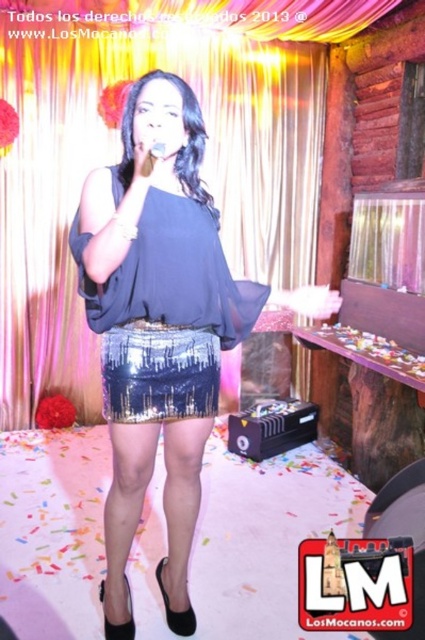
Does metallic gold curtain at upper center have a lesser width compared to shiny sequined skirt at center?

Incorrect, metallic gold curtain at upper center's width is not less than shiny sequined skirt at center's.

Does metallic gold curtain at upper center appear over shiny sequined skirt at center?

Yes.

Between point (34, 237) and point (226, 317), which one is positioned in front?

Positioned in front is point (226, 317).

I want to click on metallic gold curtain at upper center, so click(119, 160).

Consider the image. Between metallic gold curtain at upper center and sparkly sequined skirt at center, which one is positioned higher?

metallic gold curtain at upper center is above.

Is point (246, 141) less distant than point (104, 385)?

No, (246, 141) is further to viewer.

Locate an element on the screen. The height and width of the screenshot is (640, 425). metallic gold curtain at upper center is located at coordinates (119, 160).

From the picture: Which of these two, matte blue blouse at center or sparkly sequined skirt at center, stands taller?

matte blue blouse at center is taller.

Does matte blue blouse at center appear on the right side of sparkly sequined skirt at center?

Correct, you'll find matte blue blouse at center to the right of sparkly sequined skirt at center.

Who is more distant from viewer, [101,221] or [136,340]?

The point [136,340] is behind.

You are a GUI agent. You are given a task and a screenshot of the screen. Output one action in this format:
    pyautogui.click(x=<x>, y=<y>)
    Task: Click on the matte blue blouse at center
    The width and height of the screenshot is (425, 640).
    Given the screenshot: What is the action you would take?
    pyautogui.click(x=161, y=326)